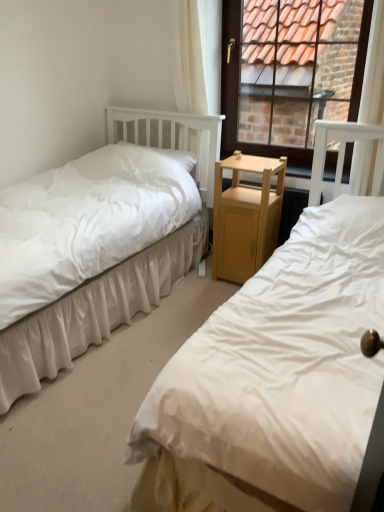
Where is `white sheer curtain at upper center`? white sheer curtain at upper center is located at coordinates (200, 77).

The width and height of the screenshot is (384, 512). What do you see at coordinates (113, 269) in the screenshot?
I see `white fabric bed at left, positioned as the second bed in right-to-left order` at bounding box center [113, 269].

Identify the location of light wood nightstand at center. pos(246,217).

Which object is positioned more to the left, white sheer curtain at upper center or white fabric bed at left, which ranks as the first bed in right-to-left order?

white sheer curtain at upper center is more to the left.

Is white sheer curtain at upper center situated inside white fabric bed at left, which ranks as the second bed in left-to-right order, or outside?

white sheer curtain at upper center is not inside white fabric bed at left, which ranks as the second bed in left-to-right order, it's outside.

From a real-world perspective, is white sheer curtain at upper center physically above white fabric bed at left, which ranks as the first bed in right-to-left order?

Indeed, from a real-world perspective, white sheer curtain at upper center stands above white fabric bed at left, which ranks as the first bed in right-to-left order.

Locate an element on the screen. This screenshot has width=384, height=512. curtain on the left of the white fabric bed at left, which ranks as the second bed in left-to-right order is located at coordinates (200, 77).

How many degrees apart are the facing directions of light wood nightstand at center and brown wooden window at upper center?

They differ by 0.113 degrees in their facing directions.

Does light wood nightstand at center lie in front of brown wooden window at upper center?

No.

Identify the location of nightstand that appears below the brown wooden window at upper center (from a real-world perspective). The image size is (384, 512). (246, 217).

Between light wood nightstand at center and brown wooden window at upper center, which one has larger size?

light wood nightstand at center.

Can you confirm if brown wooden window at upper center is taller than white fabric bed at left, positioned as the second bed in right-to-left order?

Yes, brown wooden window at upper center is taller than white fabric bed at left, positioned as the second bed in right-to-left order.

From the image's perspective, between brown wooden window at upper center and white fabric bed at left, positioned as the second bed in right-to-left order, who is located below?

From the image's view, white fabric bed at left, positioned as the second bed in right-to-left order, is below.

Based on the photo, which of these two, brown wooden window at upper center or white fabric bed at left, the first bed positioned from the left, is thinner?

brown wooden window at upper center.

Could you measure the distance between brown wooden window at upper center and white fabric bed at left, positioned as the second bed in right-to-left order?

A distance of 2.08 meters exists between brown wooden window at upper center and white fabric bed at left, positioned as the second bed in right-to-left order.

Is white sheer curtain at upper center aimed at light wood nightstand at center?

No, white sheer curtain at upper center is not facing towards light wood nightstand at center.

Can we say white sheer curtain at upper center lies outside light wood nightstand at center?

white sheer curtain at upper center is positioned outside light wood nightstand at center.

Based on their sizes in the image, would you say white sheer curtain at upper center is bigger or smaller than light wood nightstand at center?

white sheer curtain at upper center is smaller than light wood nightstand at center.

Which is nearer, (206, 79) or (223, 209)?

Point (206, 79) is positioned farther from the camera compared to point (223, 209).

From a real-world perspective, which object rests below the other?

white fabric bed at left, positioned as the second bed in right-to-left order.

Based on the photo, can you confirm if white fabric bed at left, which ranks as the second bed in left-to-right order, is taller than white fabric bed at left, positioned as the second bed in right-to-left order?

Indeed, white fabric bed at left, which ranks as the second bed in left-to-right order, has a greater height compared to white fabric bed at left, positioned as the second bed in right-to-left order.

Are white fabric bed at left, which ranks as the first bed in right-to-left order, and white fabric bed at left, the first bed positioned from the left, far apart?

Yes, white fabric bed at left, which ranks as the first bed in right-to-left order, and white fabric bed at left, the first bed positioned from the left, are quite far apart.

Considering the relative positions of white fabric bed at left, which ranks as the second bed in left-to-right order, and white fabric bed at left, positioned as the second bed in right-to-left order, in the image provided, is white fabric bed at left, which ranks as the second bed in left-to-right order, in front of white fabric bed at left, positioned as the second bed in right-to-left order,?

Yes, white fabric bed at left, which ranks as the second bed in left-to-right order, is in front of white fabric bed at left, positioned as the second bed in right-to-left order.

Is white fabric bed at left, positioned as the second bed in right-to-left order, far from light wood nightstand at center?

Actually, white fabric bed at left, positioned as the second bed in right-to-left order, and light wood nightstand at center are a little close together.

Image resolution: width=384 pixels, height=512 pixels. I want to click on nightstand above the white fabric bed at left, positioned as the second bed in right-to-left order (from the image's perspective), so click(x=246, y=217).

Can you confirm if white fabric bed at left, the first bed positioned from the left, is bigger than light wood nightstand at center?

Indeed, white fabric bed at left, the first bed positioned from the left, has a larger size compared to light wood nightstand at center.

From the image's perspective, is white fabric bed at left, the first bed positioned from the left, under light wood nightstand at center?

Indeed, from the image's perspective, white fabric bed at left, the first bed positioned from the left, is shown beneath light wood nightstand at center.

From the image's perspective, is white sheer curtain at upper center positioned above or below white fabric bed at left, positioned as the second bed in right-to-left order?

white sheer curtain at upper center is above white fabric bed at left, positioned as the second bed in right-to-left order.

Can you confirm if white sheer curtain at upper center is thinner than white fabric bed at left, positioned as the second bed in right-to-left order?

Yes.

From a real-world perspective, which is physically below, white sheer curtain at upper center or white fabric bed at left, positioned as the second bed in right-to-left order?

white fabric bed at left, positioned as the second bed in right-to-left order, is physically lower.

The image size is (384, 512). I want to click on curtain above the white fabric bed at left, which ranks as the first bed in right-to-left order (from the image's perspective), so click(200, 77).

What are the coordinates of `window on the right of light wood nightstand at center` in the screenshot? It's located at (290, 72).

Which object lies nearer to the anchor point brown wooden window at upper center, white fabric bed at left, positioned as the second bed in right-to-left order, or light wood nightstand at center?

The object closer to brown wooden window at upper center is light wood nightstand at center.

Considering their positions, is white fabric bed at left, which ranks as the first bed in right-to-left order, positioned further to light wood nightstand at center than brown wooden window at upper center?

Among the two, brown wooden window at upper center is located further to light wood nightstand at center.

Considering their positions, is brown wooden window at upper center positioned further to light wood nightstand at center than white fabric bed at left, which ranks as the first bed in right-to-left order?

Based on the image, brown wooden window at upper center appears to be further to light wood nightstand at center.

When comparing their distances from white sheer curtain at upper center, does white fabric bed at left, the first bed positioned from the left, or brown wooden window at upper center seem closer?

white fabric bed at left, the first bed positioned from the left, is positioned closer to the anchor white sheer curtain at upper center.

Based on their spatial positions, is white fabric bed at left, the first bed positioned from the left, or white sheer curtain at upper center further from brown wooden window at upper center?

white fabric bed at left, the first bed positioned from the left.

When comparing their distances from white fabric bed at left, which ranks as the first bed in right-to-left order, does brown wooden window at upper center or light wood nightstand at center seem further?

The object further to white fabric bed at left, which ranks as the first bed in right-to-left order, is brown wooden window at upper center.

Considering their positions, is brown wooden window at upper center positioned further to white fabric bed at left, which ranks as the second bed in left-to-right order, than white sheer curtain at upper center?

brown wooden window at upper center is further to white fabric bed at left, which ranks as the second bed in left-to-right order.

From the image, which object appears to be nearer to light wood nightstand at center, white fabric bed at left, the first bed positioned from the left, or white fabric bed at left, which ranks as the first bed in right-to-left order?

Based on the image, white fabric bed at left, the first bed positioned from the left, appears to be nearer to light wood nightstand at center.

Find the location of a particular element. bed between white fabric bed at left, which ranks as the second bed in left-to-right order, and light wood nightstand at center in the front-back direction is located at coordinates (113, 269).

This screenshot has height=512, width=384. Identify the location of bed positioned between white fabric bed at left, which ranks as the first bed in right-to-left order, and white sheer curtain at upper center from near to far. (113, 269).

The height and width of the screenshot is (512, 384). I want to click on nightstand positioned between white fabric bed at left, which ranks as the first bed in right-to-left order, and white sheer curtain at upper center from near to far, so click(246, 217).

The width and height of the screenshot is (384, 512). In order to click on curtain between brown wooden window at upper center and light wood nightstand at center in the up-down direction in this screenshot , I will do `click(200, 77)`.